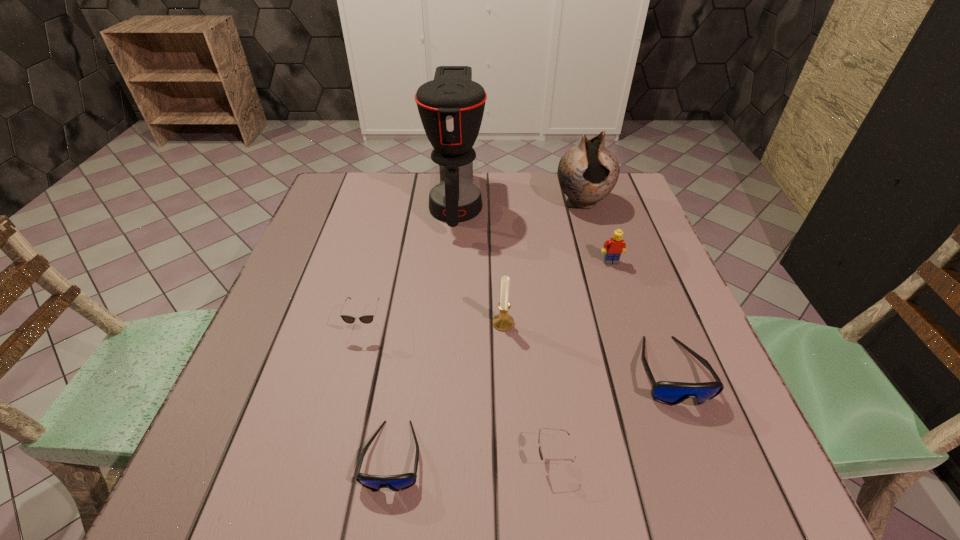
Find the location of a particular element. This screenshot has height=540, width=960. free space between the tallest object and the pottery is located at coordinates (519, 203).

The image size is (960, 540). In order to click on vacant area that lies between the yellow Lego and the farther blue sunglasses in this screenshot , I will do `click(641, 316)`.

Find the location of a particular element. The image size is (960, 540). empty space between the tallest object and the fifth shortest object is located at coordinates (534, 233).

I want to click on vacant point located between the seventh shortest object and the bigger blue sunglasses, so click(627, 287).

Where is `vacant area between the third farthest object and the left black sunglasses`? Image resolution: width=960 pixels, height=540 pixels. vacant area between the third farthest object and the left black sunglasses is located at coordinates click(489, 294).

You are a GUI agent. You are given a task and a screenshot of the screen. Output one action in this format:
    pyautogui.click(x=<x>, y=<y>)
    Task: Click on the object that is the fifth closest to the left black sunglasses
    The height and width of the screenshot is (540, 960).
    Given the screenshot: What is the action you would take?
    pyautogui.click(x=671, y=393)

The image size is (960, 540). What are the coordinates of `the sixth closest object relative to the coffee maker` in the screenshot? It's located at (399, 482).

Locate an element on the screen. sunglasses that is the third closest to the farther blue sunglasses is located at coordinates (366, 319).

Locate an element on the screen. sunglasses that stands as the fourth closest to the sixth shortest object is located at coordinates (399, 482).